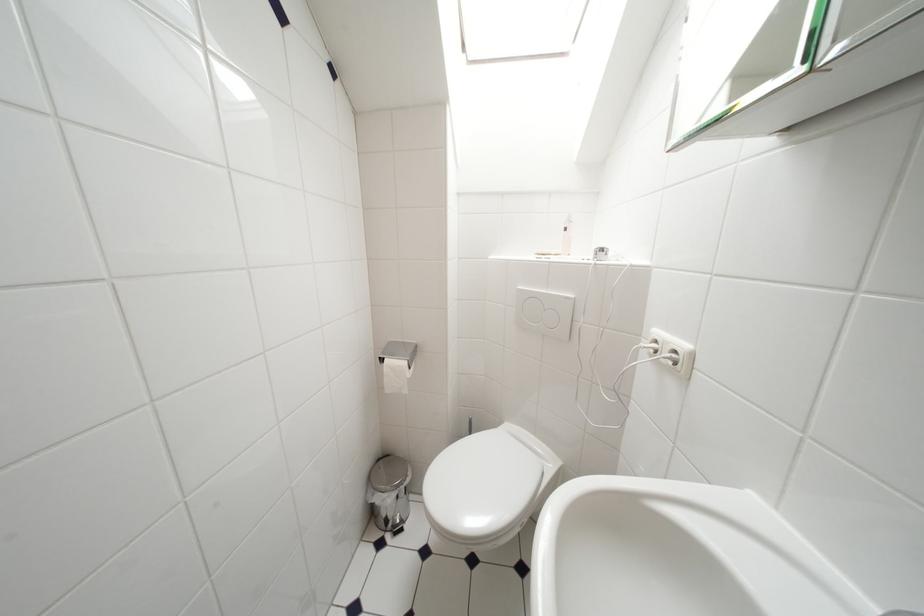
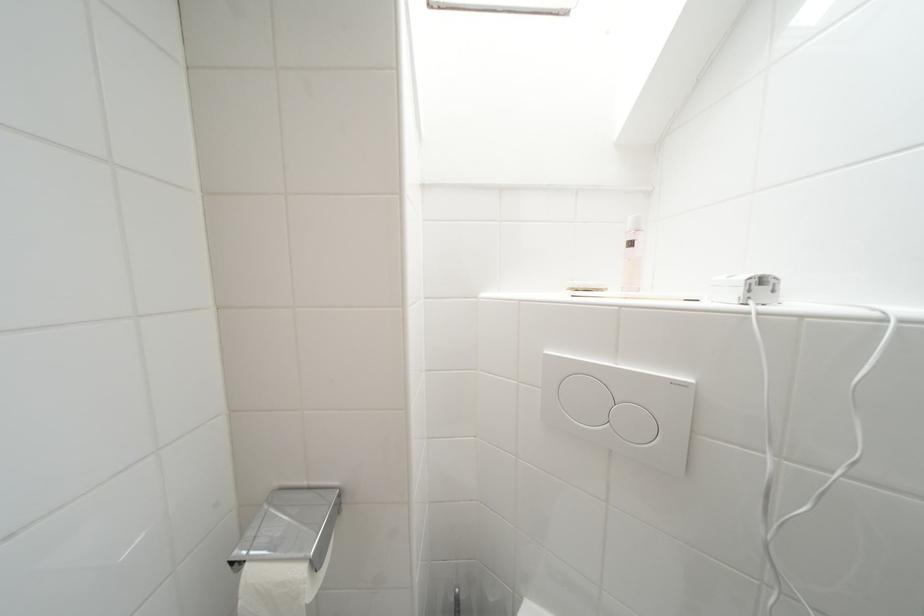
Question: I am providing you with two images of the same scene from different viewpoints. After the viewpoint changes to image2, which objects are now occluded?

Choices:
 (A) large toilet flush button
 (B) small toilet flush button
 (C) toilet paper roll
 (D) none of these

Answer: (D)